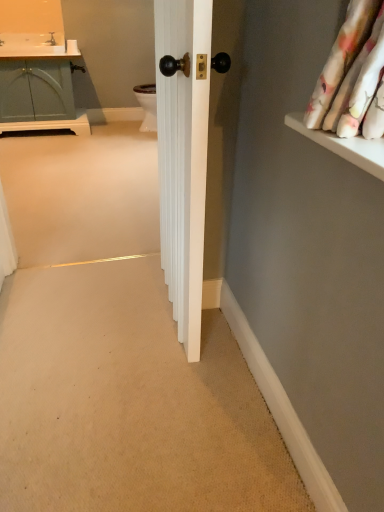
Question: Should I look upward or downward to see white smooth baseboard at lower right?

Choices:
 (A) down
 (B) up

Answer: (A)